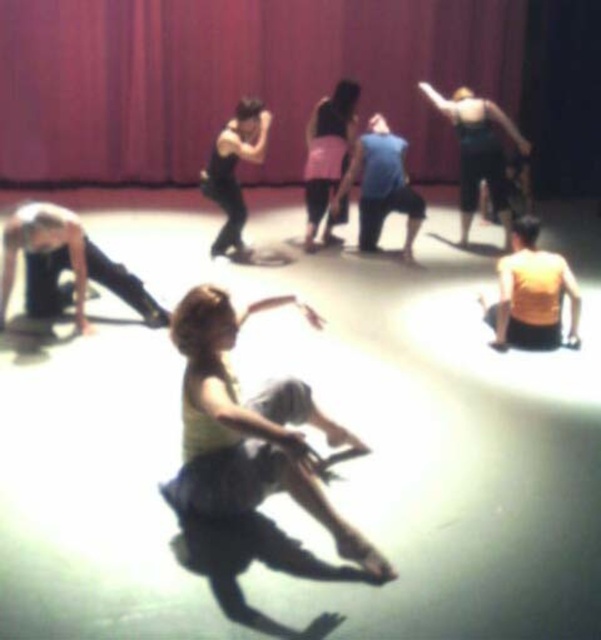
Question: Does matte yellow tank top at center appear under green fabric dress at upper right?

Choices:
 (A) yes
 (B) no

Answer: (A)

Question: Which point is closer to the camera taking this photo?

Choices:
 (A) (230, 140)
 (B) (343, 92)
 (C) (499, 189)
 (D) (373, 221)

Answer: (A)

Question: Can you confirm if matte red curtain at upper center is positioned below pink fabric skirt at center?

Choices:
 (A) no
 (B) yes

Answer: (A)

Question: Which of the following is the farthest from the observer?

Choices:
 (A) matte yellow tank top at center
 (B) matte red curtain at upper center

Answer: (B)

Question: From the image, what is the correct spatial relationship of green fabric dress at upper right in relation to blue cotton shirt at center?

Choices:
 (A) above
 (B) below

Answer: (A)

Question: Among these points, which one is farthest from the camera?

Choices:
 (A) (215, 339)
 (B) (269, 140)
 (C) (316, 225)
 (D) (471, 115)

Answer: (B)